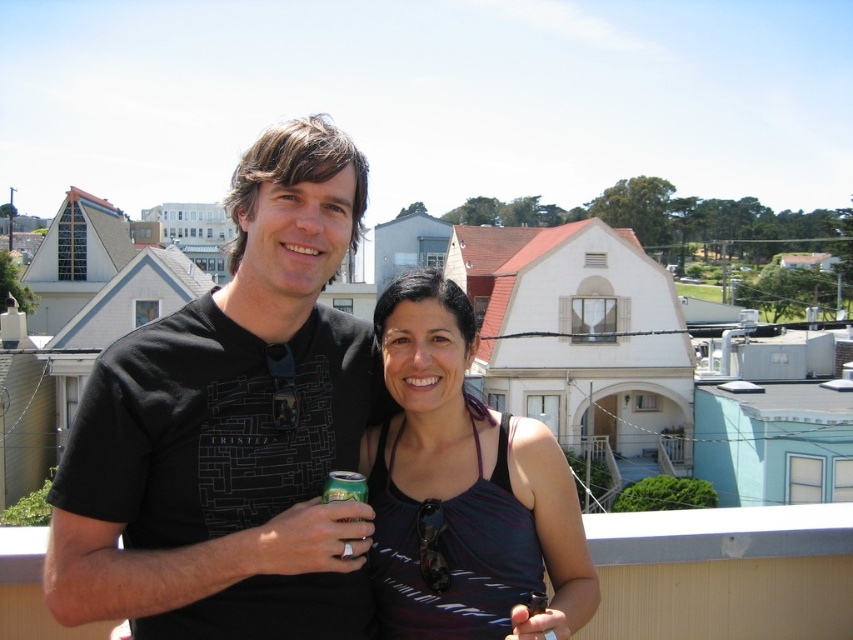
Between point (51, 572) and point (338, 492), which one is positioned behind?

The point (338, 492) is behind.

Find the location of a particular element. The height and width of the screenshot is (640, 853). black matte t-shirt at center is located at coordinates (231, 429).

The width and height of the screenshot is (853, 640). I want to click on black matte t-shirt at center, so click(x=231, y=429).

Between black matte t-shirt at center and matte black tank top at center, which one is positioned higher?

black matte t-shirt at center is above.

Consider the image. Can you confirm if black matte t-shirt at center is positioned to the right of matte black tank top at center?

In fact, black matte t-shirt at center is to the left of matte black tank top at center.

Between point (323, 328) and point (541, 579), which one is positioned in front?

Point (541, 579)

Locate an element on the screen. This screenshot has width=853, height=640. black matte t-shirt at center is located at coordinates (231, 429).

Is matte black tank top at center bigger than green metallic can at center?

Yes, matte black tank top at center is bigger than green metallic can at center.

Can you confirm if matte black tank top at center is taller than green metallic can at center?

Indeed, matte black tank top at center has a greater height compared to green metallic can at center.

Between point (477, 428) and point (326, 500), which one is positioned behind?

The point (477, 428) is more distant.

Locate an element on the screen. matte black tank top at center is located at coordinates (463, 490).